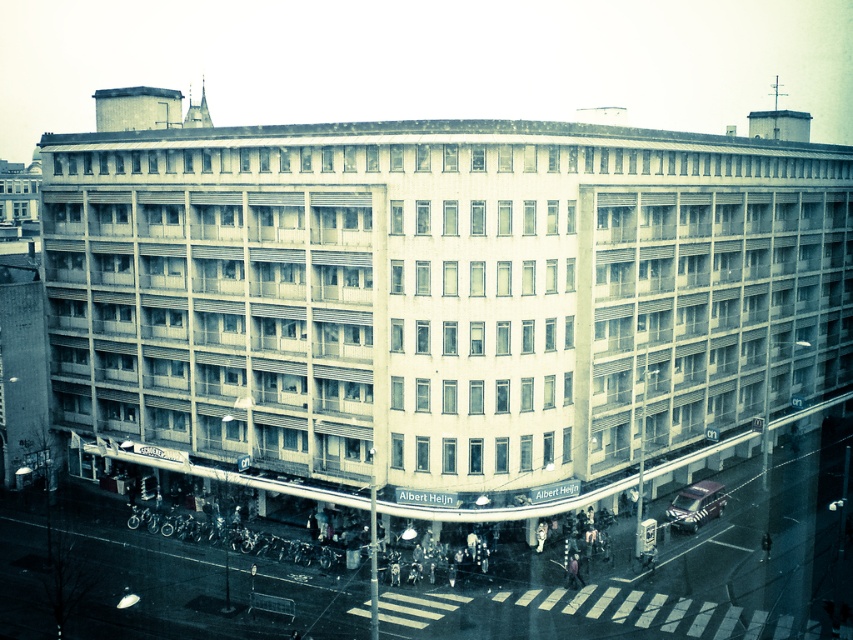
Question: Does smooth concrete building at center appear over pink fabric person at lower center?

Choices:
 (A) yes
 (B) no

Answer: (A)

Question: Does metallic silver car at lower right have a lesser width compared to pink fabric person at lower center?

Choices:
 (A) yes
 (B) no

Answer: (B)

Question: Which point is closer to the camera?

Choices:
 (A) (567, 570)
 (B) (763, 554)

Answer: (A)

Question: Among these objects, which one is nearest to the camera?

Choices:
 (A) dark fabric jacket at lower right
 (B) smooth concrete building at center

Answer: (B)

Question: Which point is farther to the camera?

Choices:
 (A) (763, 540)
 (B) (701, 492)

Answer: (B)

Question: Can you confirm if smooth concrete building at center is bigger than pink fabric person at lower center?

Choices:
 (A) no
 (B) yes

Answer: (B)